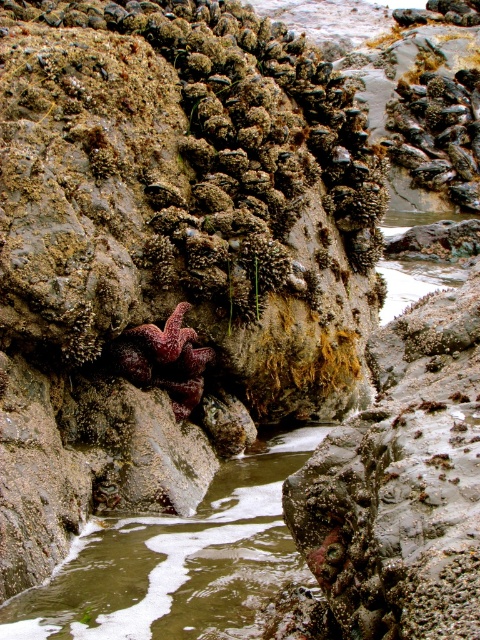
You are a marine biologist observing the tide pool. You notice the greenish water at center and the red matte starfish at center. Which object is closer to you?

The greenish water at center is in front of the red matte starfish at center, so the greenish water at center is closer to you.

You are a marine biologist examining the tide pools. You notice the greenish water at center and the red matte starfish at center. Which object is located to the right of the other?

The greenish water at center is positioned on the right side of red matte starfish at center.